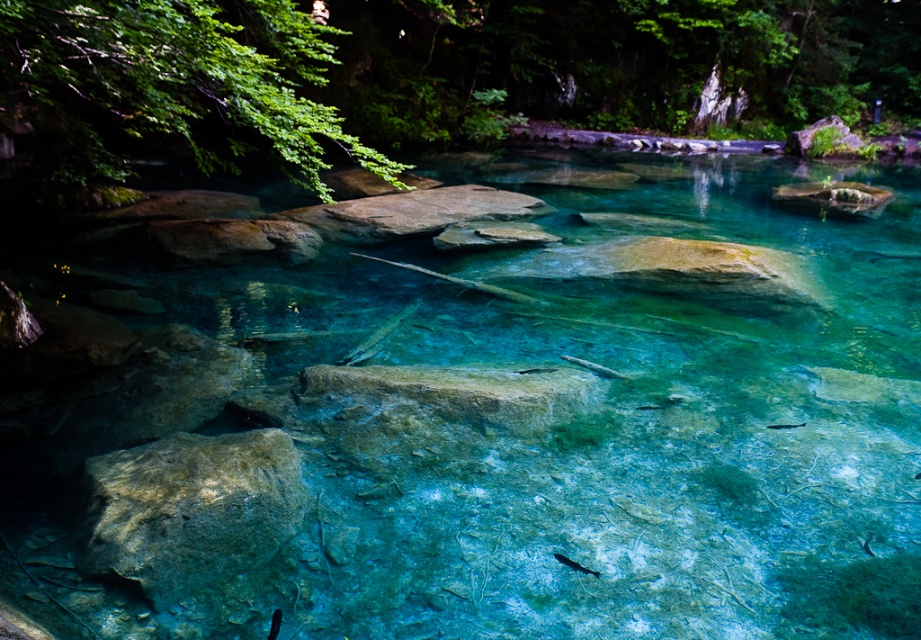
Question: Does translucent blue fish at center have a larger size compared to shiny silver fish at center?

Choices:
 (A) yes
 (B) no

Answer: (A)

Question: Estimate the real-world distances between objects in this image. Which object is farther from the translucent blue fish at center?

Choices:
 (A) shiny silver fish at center
 (B) shiny blue fish at center

Answer: (B)

Question: Considering the real-world distances, which object is closest to the shiny blue fish at center?

Choices:
 (A) shiny silver fish at center
 (B) translucent blue fish at center
 (C) translucent rock at lower left

Answer: (A)

Question: Is translucent rock at lower left further to the viewer compared to translucent blue fish at center?

Choices:
 (A) yes
 (B) no

Answer: (B)

Question: Can you confirm if shiny blue fish at center is positioned below translucent blue fish at center?

Choices:
 (A) yes
 (B) no

Answer: (A)

Question: Which object is farther from the camera taking this photo?

Choices:
 (A) shiny silver fish at center
 (B) translucent blue fish at center
 (C) translucent rock at lower left

Answer: (B)